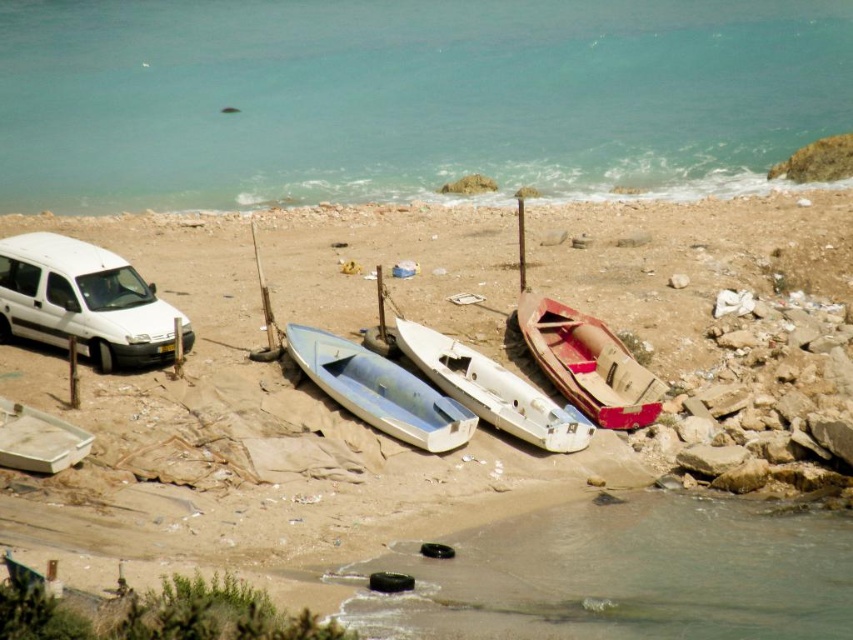
Can you confirm if clear blue water at upper center is taller than white plastic canoe at center?

Correct, clear blue water at upper center is much taller as white plastic canoe at center.

Is point (833, 61) positioned behind point (440, 336)?

Yes.

Find the location of a particular element. The image size is (853, 640). clear blue water at upper center is located at coordinates (405, 97).

Who is shorter, clear blue water at upper center or metallic silver canoe at center?

With less height is metallic silver canoe at center.

Is point (469, 13) behind point (437, 429)?

Yes.

Find the location of a particular element. clear blue water at upper center is located at coordinates [x=405, y=97].

Does metallic silver canoe at center come behind white plastic canoe at center?

No, metallic silver canoe at center is in front of white plastic canoe at center.

From the picture: Can you confirm if metallic silver canoe at center is bigger than white plastic canoe at center?

Actually, metallic silver canoe at center might be smaller than white plastic canoe at center.

Between point (347, 374) and point (495, 413), which one is positioned in front?

Positioned in front is point (495, 413).

Identify the location of metallic silver canoe at center. The image size is (853, 640). (379, 390).